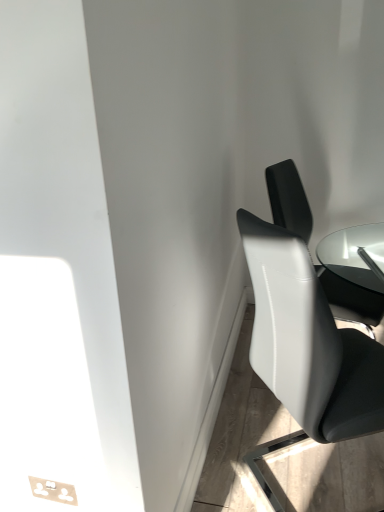
Question: Considering the relative sizes of white leather chair at right, the 1th chair from the back, and white glossy chair at right, which is the 2th chair in back-to-front order, in the image provided, is white leather chair at right, the 1th chair from the back, shorter than white glossy chair at right, which is the 2th chair in back-to-front order,?

Choices:
 (A) yes
 (B) no

Answer: (A)

Question: Is white leather chair at right, the 1th chair from the back, oriented towards white glossy chair at right, the first chair viewed from the front?

Choices:
 (A) no
 (B) yes

Answer: (A)

Question: Is white leather chair at right, placed as the second chair when sorted from front to back, not inside white glossy chair at right, which is the 2th chair in back-to-front order?

Choices:
 (A) no
 (B) yes

Answer: (B)

Question: Are white leather chair at right, the 1th chair from the back, and white glossy chair at right, which is the 2th chair in back-to-front order, located far from each other?

Choices:
 (A) no
 (B) yes

Answer: (A)

Question: Is white leather chair at right, the 1th chair from the back, at the right side of white glossy chair at right, the first chair viewed from the front?

Choices:
 (A) no
 (B) yes

Answer: (B)

Question: Is white leather chair at right, placed as the second chair when sorted from front to back, taller than white glossy chair at right, which is the 2th chair in back-to-front order?

Choices:
 (A) no
 (B) yes

Answer: (A)

Question: From the image's perspective, is white glossy chair at right, the first chair viewed from the front, under white leather chair at right, placed as the second chair when sorted from front to back?

Choices:
 (A) no
 (B) yes

Answer: (B)

Question: Is white glossy chair at right, which is the 2th chair in back-to-front order, to the right of white leather chair at right, the 1th chair from the back, from the viewer's perspective?

Choices:
 (A) no
 (B) yes

Answer: (A)

Question: Can you confirm if white glossy chair at right, the first chair viewed from the front, is bigger than white leather chair at right, the 1th chair from the back?

Choices:
 (A) yes
 (B) no

Answer: (A)

Question: Is white glossy chair at right, which is the 2th chair in back-to-front order, looking in the opposite direction of white leather chair at right, the 1th chair from the back?

Choices:
 (A) no
 (B) yes

Answer: (A)

Question: From a real-world perspective, is white glossy chair at right, which is the 2th chair in back-to-front order, positioned over white leather chair at right, placed as the second chair when sorted from front to back, based on gravity?

Choices:
 (A) yes
 (B) no

Answer: (B)

Question: Is white glossy chair at right, which is the 2th chair in back-to-front order, surrounding white leather chair at right, the 1th chair from the back?

Choices:
 (A) no
 (B) yes

Answer: (A)

Question: Is white leather chair at right, placed as the second chair when sorted from front to back, taller or shorter than white glossy chair at right, the first chair viewed from the front?

Choices:
 (A) tall
 (B) short

Answer: (B)